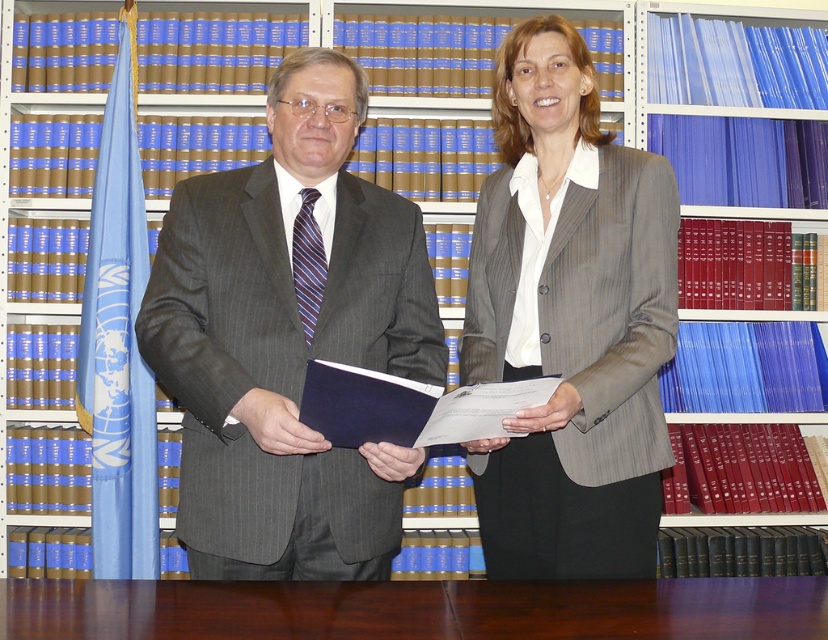
Question: Estimate the real-world distances between objects in this image. Which object is closer to the brown wood table at center?

Choices:
 (A) matte gray suit at center
 (B) gray pinstripe blazer at center

Answer: (A)

Question: Among these objects, which one is farthest from the camera?

Choices:
 (A) gray pinstripe blazer at center
 (B) matte gray suit at center

Answer: (A)

Question: Estimate the real-world distances between objects in this image. Which object is closer to the matte gray suit at center?

Choices:
 (A) brown wood table at center
 (B) gray pinstripe blazer at center

Answer: (B)

Question: Does matte gray suit at center have a lesser width compared to gray pinstripe blazer at center?

Choices:
 (A) yes
 (B) no

Answer: (B)

Question: Observing the image, what is the correct spatial positioning of matte gray suit at center in reference to gray pinstripe blazer at center?

Choices:
 (A) above
 (B) below

Answer: (B)

Question: Can you confirm if gray pinstripe blazer at center is positioned below brown wood table at center?

Choices:
 (A) no
 (B) yes

Answer: (A)